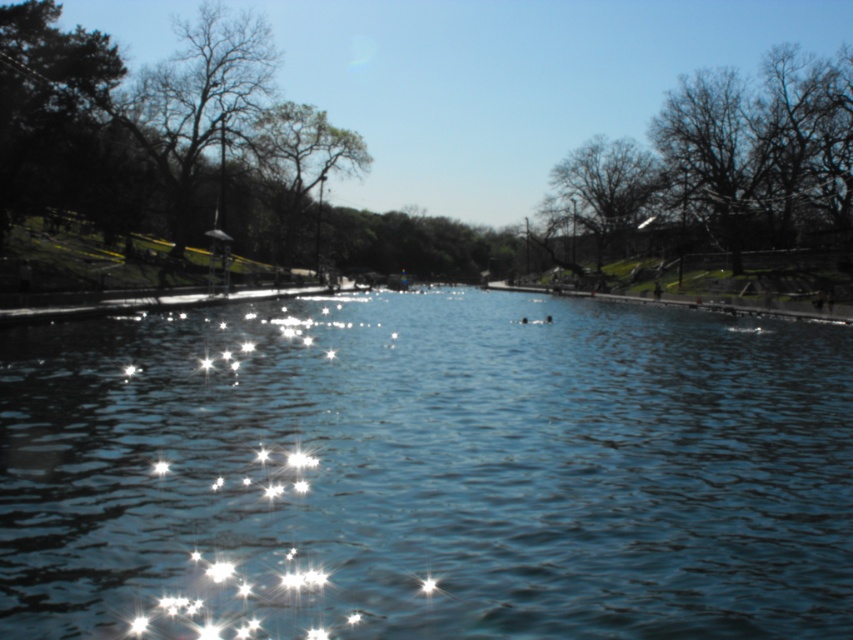
You are an artist sketching the scene and want to draw the bare branches at upper right and the dark green textured tree at upper center. Which one should you draw first if you follow the left to right direction?

The dark green textured tree at upper center should be drawn first because it is positioned to the left of the bare branches at upper right.

You are an environmental scientist assessing the forest composition in the image. You observe the dark green textured tree at upper center and the green leafy tree at upper center. Which tree is taller?

The dark green textured tree at upper center is taller than the green leafy tree at upper center according to the description.